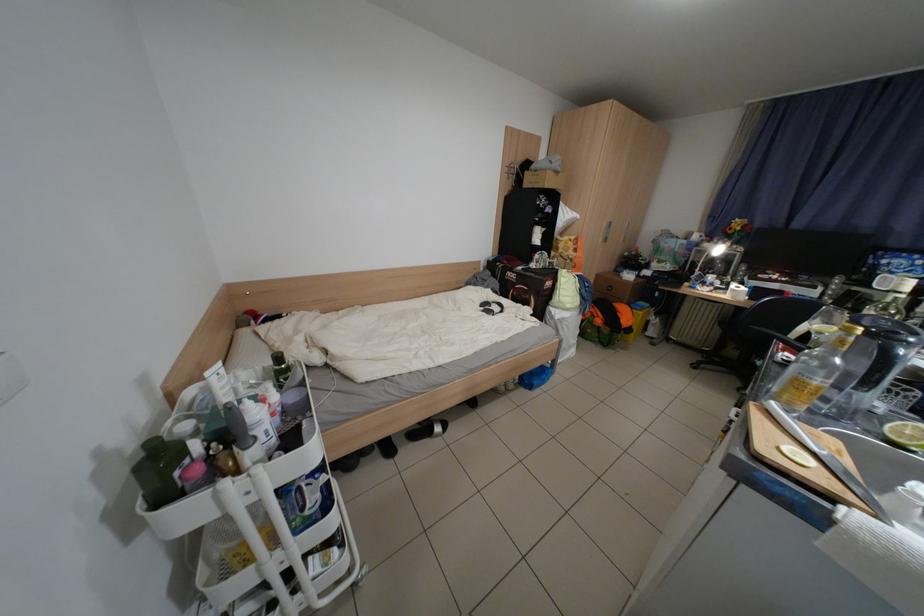
Where would you lift the green plastic bottle? Please return your answer as a coordinate pair (x, y).

(160, 469)